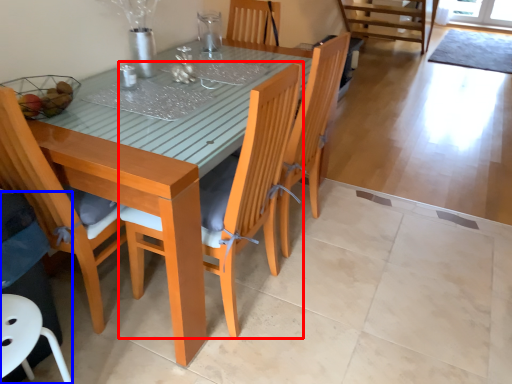
Question: Among these objects, which one is farthest to the camera, chair (highlighted by a red box) or swivel chair (highlighted by a blue box)?

Choices:
 (A) chair
 (B) swivel chair

Answer: (B)